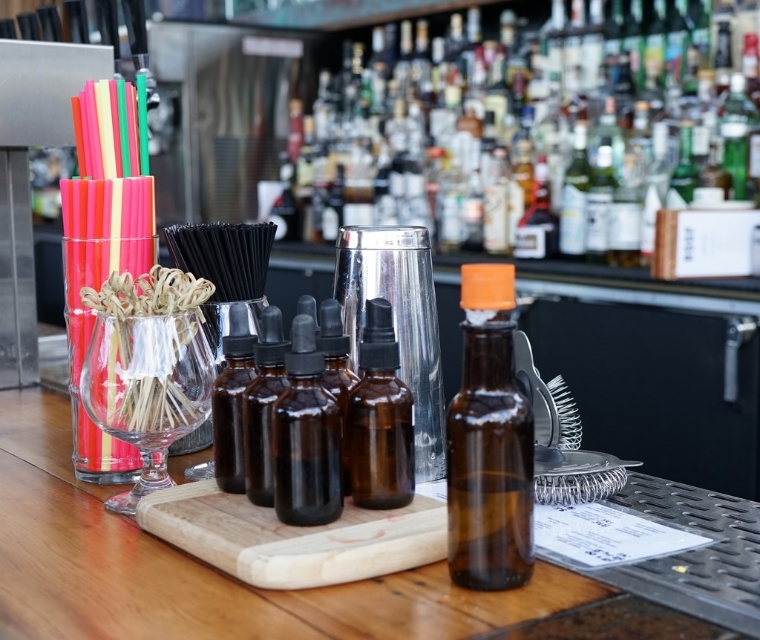
You are a bartender preparing a drink. You need to place an order for a new bottle that must be placed exactly at the same position as the amber glass bottle at center. What are the coordinates where you should place the new bottle?

The coordinates for the amber glass bottle at center are at point [488,442], so you should place the new bottle at those coordinates.

You are a bartender preparing a drink and need to place an 8 inch long bottle opener between the amber glass bottle at center and the brown glass bottles at center. Is there enough space between them to fit the bottle opener?

The amber glass bottle at center and brown glass bottles at center are 6.74 inches apart. Since the bottle opener is 8 inches long, it cannot fit between them as the distance is less than the required space.

You are a bartender preparing a drink and need to place both the amber glass dropper bottle at center and the brown glass bottles at center on a shelf that can only hold items taking up the same amount of space. Can you fit both on the shelf?

The amber glass dropper bottle at center occupies less space than brown glass bottles at center. Since the shelf requires items to take up the same amount of space, the amber glass dropper bottle at center would take up less space, so they cannot both fit unless the brown glass bottles at center are rearranged or moved to a different shelf.